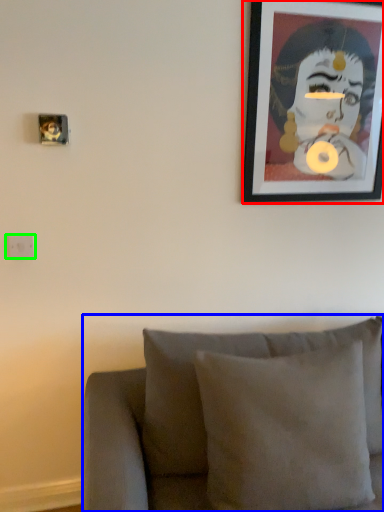
Question: Estimate the real-world distances between objects in this image. Which object is closer to picture frame (highlighted by a red box), furniture (highlighted by a blue box) or electric outlet (highlighted by a green box)?

Choices:
 (A) furniture
 (B) electric outlet

Answer: (A)